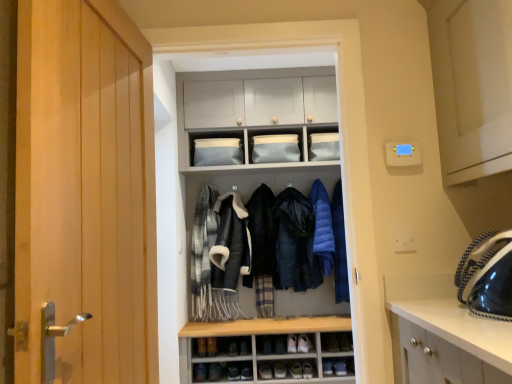
What do you see at coordinates (322, 226) in the screenshot? I see `blue down jacket at center, acting as the 4th clothing starting from the left` at bounding box center [322, 226].

Where is `blue down jacket at center, acting as the 4th clothing starting from the left`? The width and height of the screenshot is (512, 384). blue down jacket at center, acting as the 4th clothing starting from the left is located at coordinates (322, 226).

Measure the distance between matte gray fabric at upper center, acting as the second cabinet starting from the right, and camera.

matte gray fabric at upper center, acting as the second cabinet starting from the right, is 3.29 meters from camera.

The height and width of the screenshot is (384, 512). I want to click on matte gray fabric at upper center, acting as the second cabinet starting from the right, so click(275, 145).

Measure the distance between leather shoe at lower center, the 3th shoe positioned from the left, and camera.

leather shoe at lower center, the 3th shoe positioned from the left, is 3.05 meters from camera.

Based on the photo, what is the approximate width of plush fleece sweatshirt at center?

It is 36.26 centimeters.

This screenshot has height=384, width=512. Identify the location of fluffy black jacket at center, which ranks as the fourth clothing in right-to-left order. (262, 234).

In order to click on white leather shoe at lower center, positioned as the 2th shoe in left-to-right order in this screenshot , I will do `click(265, 371)`.

Can you confirm if dark blue down jacket at center, which is the 3th clothing in right-to-left order, is shorter than blue down jacket at center, acting as the 4th clothing starting from the left?

In fact, dark blue down jacket at center, which is the 3th clothing in right-to-left order, may be taller than blue down jacket at center, acting as the 4th clothing starting from the left.

In order to click on the 1st clothing in front of the dark blue down jacket at center, which is the 3th clothing in right-to-left order in this screenshot , I will do `click(322, 226)`.

Are dark blue down jacket at center, placed as the third clothing when sorted from left to right, and blue down jacket at center, arranged as the 2th clothing when viewed from the right, beside each other?

No, dark blue down jacket at center, placed as the third clothing when sorted from left to right, is not with blue down jacket at center, arranged as the 2th clothing when viewed from the right.

Is wooden door at left wider than leather shoe at lower center, acting as the second shoe starting from the bottom?

No.

Which point is more forward, (54, 116) or (284, 368)?

The point (54, 116) is closer.

In the scene shown: Visually, is wooden door at left positioned to the left or to the right of leather shoe at lower center, placed as the 1th shoe when sorted from right to left?

wooden door at left is to the left of leather shoe at lower center, placed as the 1th shoe when sorted from right to left.

Does wooden door at left touch leather shoe at lower center, the 3th shoe positioned from the left?

No.

Looking at this image, does matte gray cabinet at center have a larger size compared to matte blue fabric at upper center, the third cabinet when ordered from right to left?

Indeed, matte gray cabinet at center has a larger size compared to matte blue fabric at upper center, the third cabinet when ordered from right to left.

Can you confirm if matte gray cabinet at center is wider than matte blue fabric at upper center, the third cabinet when ordered from right to left?

Yes, matte gray cabinet at center is wider than matte blue fabric at upper center, the third cabinet when ordered from right to left.

Measure the distance between matte gray cabinet at center and matte blue fabric at upper center, the third cabinet when ordered from right to left.

They are 23.18 inches apart.

From the image's perspective, would you say matte gray cabinet at center is positioned over matte blue fabric at upper center, the 1th cabinet in the left-to-right sequence?

Actually, matte gray cabinet at center appears below matte blue fabric at upper center, the 1th cabinet in the left-to-right sequence, in the image.

Find the location of `door that appears above the dark blue down jacket at center, which is the 3th clothing in right-to-left order (from the image's perspective)`. door that appears above the dark blue down jacket at center, which is the 3th clothing in right-to-left order (from the image's perspective) is located at coordinates (85, 192).

Which object is positioned more to the right, dark blue down jacket at center, placed as the third clothing when sorted from left to right, or wooden door at left?

Positioned to the right is dark blue down jacket at center, placed as the third clothing when sorted from left to right.

From their relative heights in the image, would you say dark blue down jacket at center, placed as the third clothing when sorted from left to right, is taller or shorter than wooden door at left?

dark blue down jacket at center, placed as the third clothing when sorted from left to right, is shorter than wooden door at left.

Is dark blue down jacket at center, placed as the third clothing when sorted from left to right, looking in the opposite direction of wooden door at left?

No, wooden door at left is not at the back of dark blue down jacket at center, placed as the third clothing when sorted from left to right.

Is blue down jacket at center, arranged as the 2th clothing when viewed from the right, at the back of matte blue fabric at upper center, the third cabinet when ordered from right to left?

No, matte blue fabric at upper center, the third cabinet when ordered from right to left,'s orientation is not away from blue down jacket at center, arranged as the 2th clothing when viewed from the right.

From the image's perspective, is matte blue fabric at upper center, the third cabinet when ordered from right to left, positioned above or below blue down jacket at center, arranged as the 2th clothing when viewed from the right?

matte blue fabric at upper center, the third cabinet when ordered from right to left, is above blue down jacket at center, arranged as the 2th clothing when viewed from the right.

Is the surface of matte blue fabric at upper center, the 1th cabinet in the left-to-right sequence, in direct contact with blue down jacket at center, acting as the 4th clothing starting from the left?

No, matte blue fabric at upper center, the 1th cabinet in the left-to-right sequence, is not beside blue down jacket at center, acting as the 4th clothing starting from the left.

What are the coordinates of `the 2nd cabinet directly above the fluffy black jacket at center, acting as the 2th clothing starting from the left (from a real-world perspective)` in the screenshot? It's located at (275, 145).

Is matte gray fabric at upper center, which is the second cabinet from left to right, outside of fluffy black jacket at center, acting as the 2th clothing starting from the left?

matte gray fabric at upper center, which is the second cabinet from left to right, is positioned outside fluffy black jacket at center, acting as the 2th clothing starting from the left.

From a real-world perspective, is matte gray fabric at upper center, acting as the second cabinet starting from the right, above or below fluffy black jacket at center, which ranks as the fourth clothing in right-to-left order?

From a real-world perspective, matte gray fabric at upper center, acting as the second cabinet starting from the right, is physically above fluffy black jacket at center, which ranks as the fourth clothing in right-to-left order.

In terms of height, does matte gray fabric at upper center, acting as the second cabinet starting from the right, look taller or shorter compared to fluffy black jacket at center, acting as the 2th clothing starting from the left?

Clearly, matte gray fabric at upper center, acting as the second cabinet starting from the right, is shorter compared to fluffy black jacket at center, acting as the 2th clothing starting from the left.

Is matte gray cabinet at upper center, which is the 1th cabinet in right-to-left order, at the left side of matte blue fabric at upper center, the third cabinet when ordered from right to left?

In fact, matte gray cabinet at upper center, which is the 1th cabinet in right-to-left order, is to the right of matte blue fabric at upper center, the third cabinet when ordered from right to left.

From the image's perspective, between matte gray cabinet at upper center, which is the 1th cabinet in right-to-left order, and matte blue fabric at upper center, the third cabinet when ordered from right to left, which one is located above?

matte gray cabinet at upper center, which is the 1th cabinet in right-to-left order.

Does matte gray cabinet at upper center, which is the 1th cabinet in right-to-left order, lie in front of matte blue fabric at upper center, the 1th cabinet in the left-to-right sequence?

No, matte gray cabinet at upper center, which is the 1th cabinet in right-to-left order, is further to the viewer.

Find the location of a particular element. the 2nd clothing below when counting from the blue down jacket at center, acting as the 4th clothing starting from the left (from the image's perspective) is located at coordinates (295, 243).

Identify the location of door above the leather shoe at lower center, placed as the 1th shoe when sorted from right to left (from the image's perspective). The height and width of the screenshot is (384, 512). pos(85,192).

Based on their spatial positions, is white leather shoe at lower center, which is counted as the 1th shoe, starting from the bottom, or leather shoe at lower center, the 3th shoe positioned from the left, further from blue down jacket at center, the 1th clothing from the right?

The object further to blue down jacket at center, the 1th clothing from the right, is white leather shoe at lower center, which is counted as the 1th shoe, starting from the bottom.

Considering their positions, is matte gray cabinet at upper center, which is the 1th cabinet in right-to-left order, positioned further to plaid wool scarf at center, which is the 5th clothing from right to left, than leather shoe at lower center, acting as the second shoe starting from the top?

matte gray cabinet at upper center, which is the 1th cabinet in right-to-left order, lies further to plaid wool scarf at center, which is the 5th clothing from right to left, than the other object.

From the image, which object appears to be farther from blue down jacket at center, acting as the 4th clothing starting from the left, dark blue down jacket at center, placed as the third clothing when sorted from left to right, or white leather shoe at lower center, the 2th shoe when ordered from right to left?

Among the two, white leather shoe at lower center, the 2th shoe when ordered from right to left, is located further to blue down jacket at center, acting as the 4th clothing starting from the left.

When comparing their distances from brown leather shoe at lower center, which is the 3th shoe in right-to-left order, does matte gray cabinet at center or blue down jacket at center, arranged as the 2th clothing when viewed from the right, seem closer?

matte gray cabinet at center.

Which object lies further to the anchor point plush fleece sweatshirt at center, dark blue down jacket at center, placed as the third clothing when sorted from left to right, or matte blue fabric at upper center, the 1th cabinet in the left-to-right sequence?

Among the two, matte blue fabric at upper center, the 1th cabinet in the left-to-right sequence, is located further to plush fleece sweatshirt at center.

Considering their positions, is leather shoe at lower center, acting as the second shoe starting from the top, positioned closer to matte gray cabinet at upper center, which is the 1th cabinet in right-to-left order, than dark blue down jacket at center, which is the 3th clothing in right-to-left order?

dark blue down jacket at center, which is the 3th clothing in right-to-left order, is positioned closer to the anchor matte gray cabinet at upper center, which is the 1th cabinet in right-to-left order.

Based on their spatial positions, is matte blue fabric at upper center, the 1th cabinet in the left-to-right sequence, or matte gray cabinet at upper center, the 3th cabinet when ordered from left to right, closer to brown leather shoe at lower center, placed as the 3th shoe when sorted from bottom to top?

matte blue fabric at upper center, the 1th cabinet in the left-to-right sequence, is positioned closer to the anchor brown leather shoe at lower center, placed as the 3th shoe when sorted from bottom to top.

Looking at the image, which one is located further to white leather shoe at lower center, positioned as the 2th shoe in left-to-right order, matte gray cabinet at upper center, which is the 1th cabinet in right-to-left order, or wooden door at left?

Among the two, wooden door at left is located further to white leather shoe at lower center, positioned as the 2th shoe in left-to-right order.

The width and height of the screenshot is (512, 384). I want to click on sweatshirt between plaid wool scarf at center, which is the 5th clothing from right to left, and matte gray cabinet at upper center, which is the 1th cabinet in right-to-left order, so click(x=230, y=243).

Find the location of a particular element. This screenshot has height=384, width=512. cupboard between plush fleece sweatshirt at center and blue down jacket at center, the 5th clothing when ordered from left to right, in the horizontal direction is located at coordinates (259, 231).

At what (x,y) coordinates should I click in order to perform the action: click on sweatshirt between wooden door at left and blue down jacket at center, the 1th clothing from the right, from front to back. Please return your answer as a coordinate pair (x, y). This screenshot has width=512, height=384. Looking at the image, I should click on (230, 243).

Locate an element on the screen. The width and height of the screenshot is (512, 384). cupboard between matte gray fabric at upper center, which is the second cabinet from left to right, and white leather shoe at lower center, positioned as the 2th shoe in left-to-right order, from top to bottom is located at coordinates (259, 231).